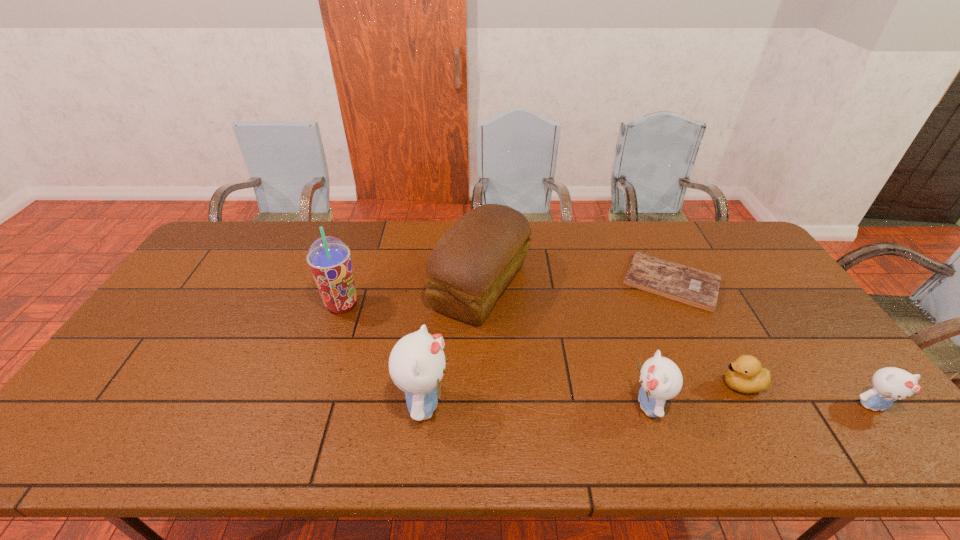
You are a GUI agent. You are given a task and a screenshot of the screen. Output one action in this format:
    pyautogui.click(x=<x>, y=<y>)
    Task: Click on the vacant space located 0.100m on the front-facing side of the tallest kitten
    The image size is (960, 540).
    Given the screenshot: What is the action you would take?
    pyautogui.click(x=492, y=404)

Identify the location of vacant space located 0.180m on the front-facing side of the fourth shortest object. The image size is (960, 540). (555, 405).

I want to click on vacant space located 0.230m on the front-facing side of the fourth shortest object, so click(534, 405).

The width and height of the screenshot is (960, 540). Find the location of `free space located on the front-facing side of the fourth shortest object`. free space located on the front-facing side of the fourth shortest object is located at coordinates (501, 405).

Locate an element on the screen. This screenshot has height=540, width=960. free space located on the left of the Bible is located at coordinates (516, 282).

This screenshot has height=540, width=960. I want to click on vacant space located on the left of the smoothie, so click(283, 305).

The image size is (960, 540). What are the coordinates of `free space located on the left of the bread` in the screenshot? It's located at (367, 286).

Find the location of a particular element. The height and width of the screenshot is (540, 960). vacant space located on the face of the duckling is located at coordinates (684, 385).

Where is `vacant space located 0.180m on the face of the duckling`? The image size is (960, 540). vacant space located 0.180m on the face of the duckling is located at coordinates (648, 385).

Identify the location of free space located 0.350m on the face of the duckling. (581, 385).